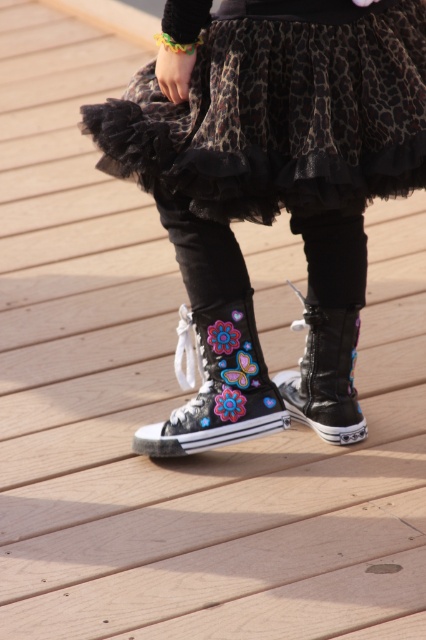
Question: Does black canvas boots at center have a lesser width compared to black canvas shoe at center?

Choices:
 (A) yes
 (B) no

Answer: (B)

Question: From the image, what is the correct spatial relationship of black canvas boots at center in relation to black canvas boot at center?

Choices:
 (A) left
 (B) right

Answer: (A)

Question: Does leopard print tulle skirt at center appear over black canvas boot at center?

Choices:
 (A) no
 (B) yes

Answer: (B)

Question: Based on their relative distances, which object is nearer to the leopard print tulle skirt at center?

Choices:
 (A) black canvas shoe at center
 (B) black canvas boots at center
 (C) black canvas boot at center

Answer: (B)

Question: Which object is farther from the camera taking this photo?

Choices:
 (A) black canvas shoe at center
 (B) black canvas boot at center
 (C) leopard print tulle skirt at center

Answer: (B)

Question: Among these objects, which one is farthest from the camera?

Choices:
 (A) black canvas boot at center
 (B) leopard print tulle skirt at center

Answer: (A)